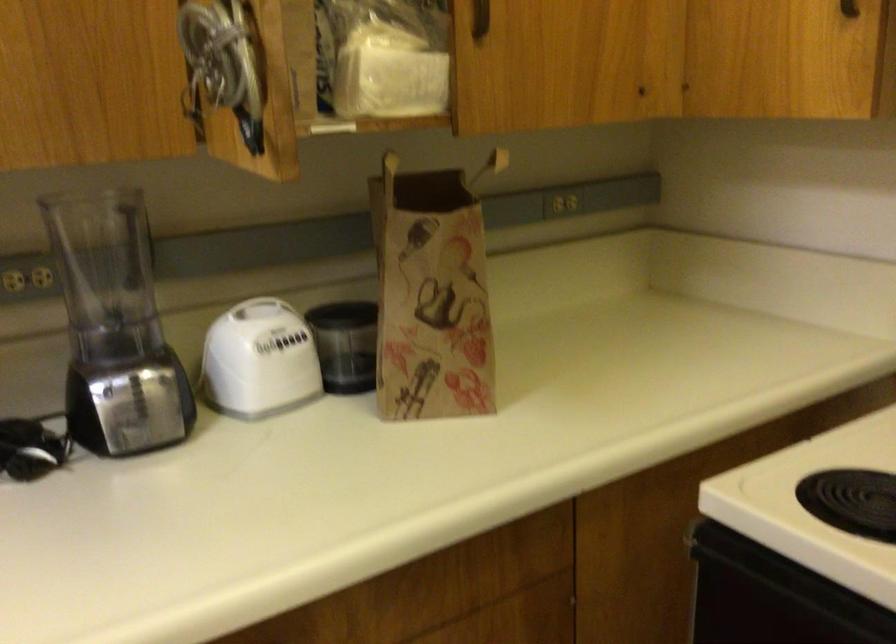
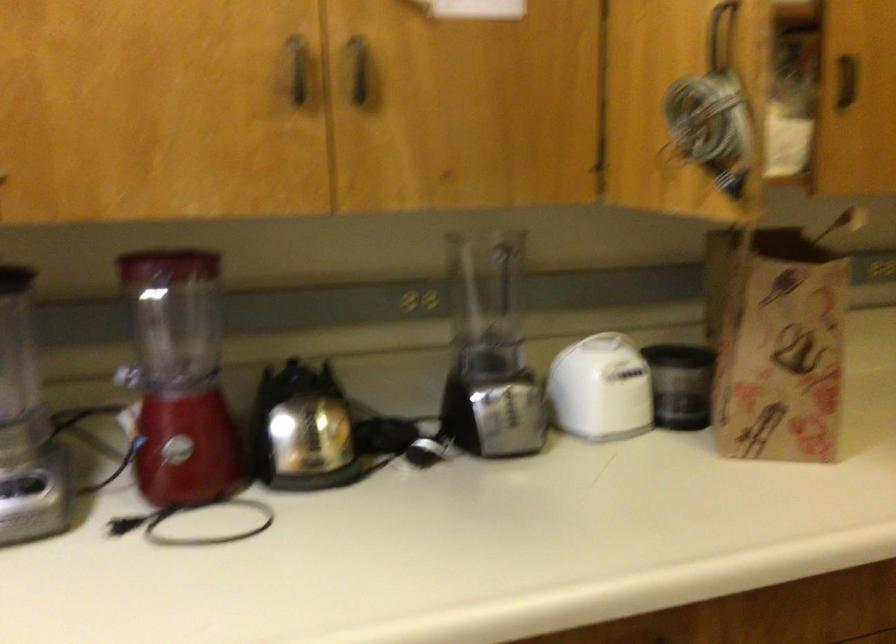
The images are taken continuously from a first-person perspective. In which direction are you moving?

The cameraman walked toward left, backward.